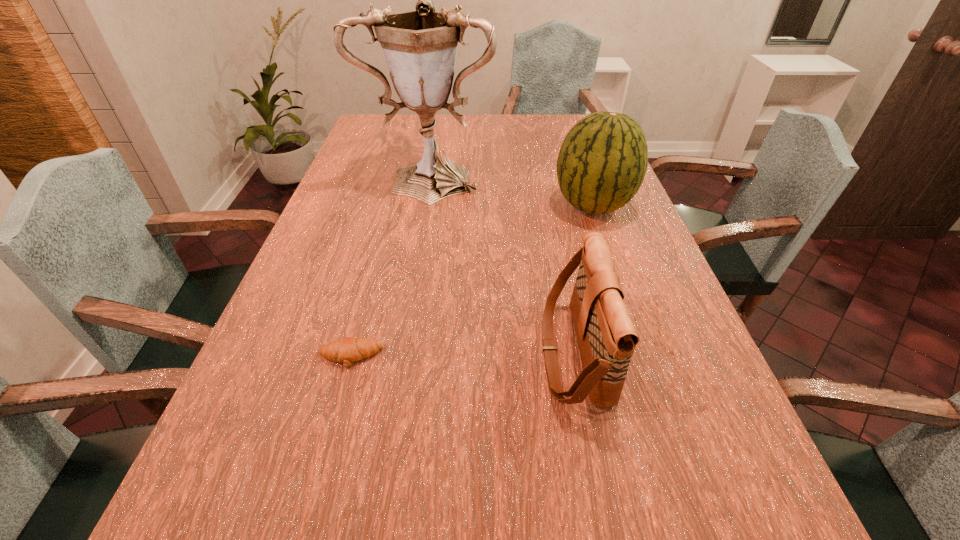
Where is `empty location between the shortest object and the trophy cup`? empty location between the shortest object and the trophy cup is located at coordinates (391, 266).

You are a GUI agent. You are given a task and a screenshot of the screen. Output one action in this format:
    pyautogui.click(x=<x>, y=<y>)
    Task: Click on the vacant region between the second tallest object and the tallest object
    The width and height of the screenshot is (960, 540).
    Given the screenshot: What is the action you would take?
    pyautogui.click(x=513, y=191)

The width and height of the screenshot is (960, 540). What are the coordinates of `vacant space that's between the shoulder bag and the shortest object` in the screenshot? It's located at (462, 355).

Find the location of a particular element. vacant area that lies between the shortest object and the watermelon is located at coordinates (471, 281).

Identify which object is located as the third nearest to the shoulder bag. Please provide its 2D coordinates. Your answer should be formatted as a tuple, i.e. [(x, y)], where the tuple contains the x and y coordinates of a point satisfying the conditions above.

[(420, 47)]

You are a GUI agent. You are given a task and a screenshot of the screen. Output one action in this format:
    pyautogui.click(x=<x>, y=<y>)
    Task: Click on the object that ranks as the third closest to the tallest object
    
    Given the screenshot: What is the action you would take?
    pyautogui.click(x=349, y=349)

Find the location of a particular element. This screenshot has width=960, height=540. vacant space that satisfies the following two spatial constraints: 1. on the front side of the watermelon; 2. on the front-facing side of the shoulder bag is located at coordinates (644, 353).